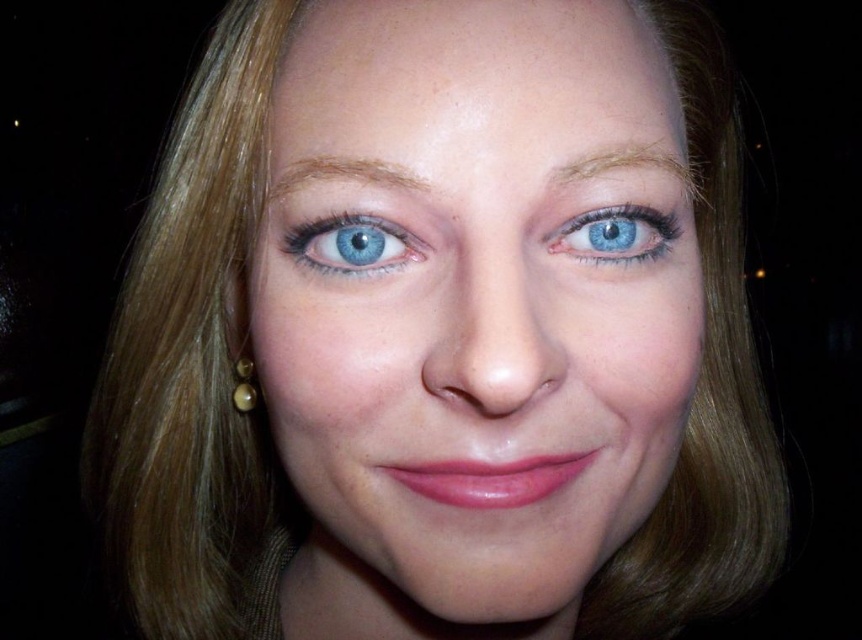
The width and height of the screenshot is (862, 640). What do you see at coordinates (336, 173) in the screenshot?
I see `brown smooth eyebrow at upper center` at bounding box center [336, 173].

Can you confirm if brown smooth eyebrow at upper center is bigger than gold pearl earring at lower left?

No, brown smooth eyebrow at upper center is not bigger than gold pearl earring at lower left.

Does point (320, 168) come in front of point (254, 392)?

Yes, point (320, 168) is in front of point (254, 392).

The width and height of the screenshot is (862, 640). What are the coordinates of `brown smooth eyebrow at upper center` in the screenshot? It's located at (336, 173).

Does smooth skin face at center have a larger size compared to light brown hair at upper center?

Yes, smooth skin face at center is bigger than light brown hair at upper center.

Where is `smooth skin face at center`? The height and width of the screenshot is (640, 862). smooth skin face at center is located at coordinates (472, 316).

Which of these two, brown smooth eyebrow at upper center or light brown hair at upper center, stands taller?

Standing taller between the two is light brown hair at upper center.

Is point (276, 196) farther from viewer compared to point (617, 163)?

Yes.

Who is more forward, (x=328, y=173) or (x=623, y=156)?

Positioned in front is point (x=328, y=173).

Find the location of a particular element. Image resolution: width=862 pixels, height=640 pixels. brown smooth eyebrow at upper center is located at coordinates (336, 173).